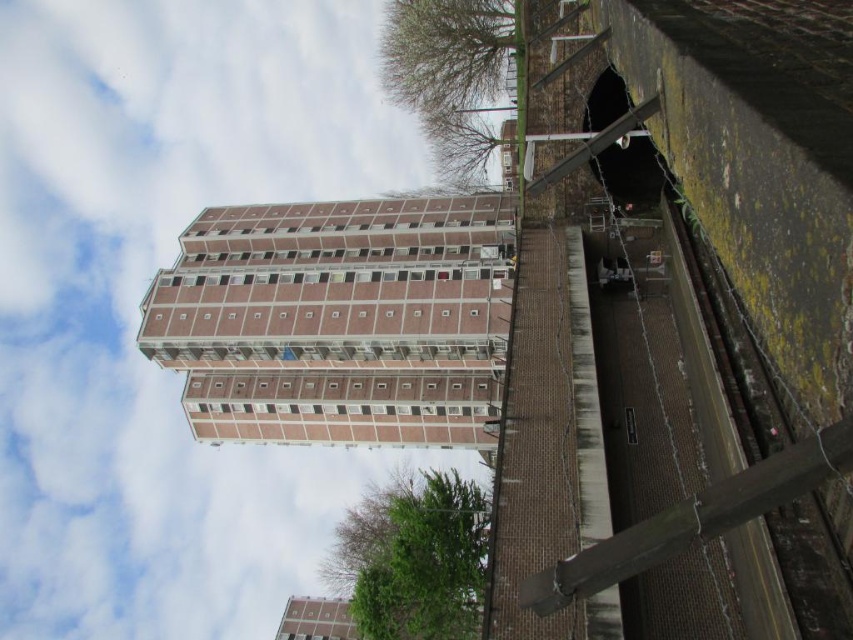
Question: Which object is farther from the camera taking this photo?

Choices:
 (A) brick textured building at center
 (B) brick building at center

Answer: (A)

Question: Is brick building at center positioned in front of brick textured building at center?

Choices:
 (A) yes
 (B) no

Answer: (A)

Question: Which of the following is the farthest from the observer?

Choices:
 (A) brick building at center
 (B) brick textured building at center

Answer: (B)

Question: Is brick building at center below brick textured building at center?

Choices:
 (A) yes
 (B) no

Answer: (B)

Question: Can you confirm if brick building at center is positioned below brick textured building at center?

Choices:
 (A) yes
 (B) no

Answer: (B)